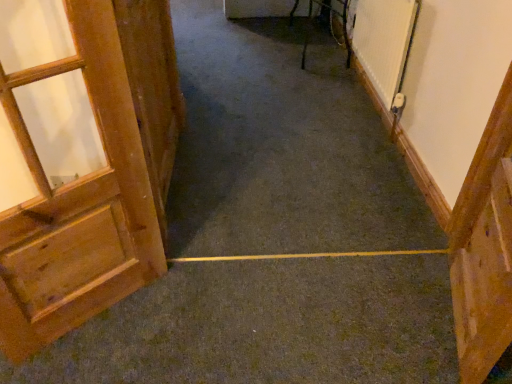
Question: Considering their positions, is wooden door at right, the third door in the left-to-right sequence, located in front of or behind wooden door at left, arranged as the 3th door when viewed from the right?

Choices:
 (A) front
 (B) behind

Answer: (B)

Question: In terms of height, does wooden door at right, the third door in the left-to-right sequence, look taller or shorter compared to wooden door at left, which is the first door in left-to-right order?

Choices:
 (A) short
 (B) tall

Answer: (A)

Question: Estimate the real-world distances between objects in this image. Which object is closer to the metallic silver chair at upper right?

Choices:
 (A) wooden door at right, which appears as the 1th door when viewed from the right
 (B) wooden door at left, arranged as the 2th door when viewed from the left
 (C) wooden door at left, which is the first door in left-to-right order

Answer: (B)

Question: Considering the real-world distances, which object is closest to the wooden door at right, which appears as the 1th door when viewed from the right?

Choices:
 (A) metallic silver chair at upper right
 (B) wooden door at left, arranged as the 3th door when viewed from the right
 (C) wooden door at left, arranged as the 2th door when viewed from the left

Answer: (B)